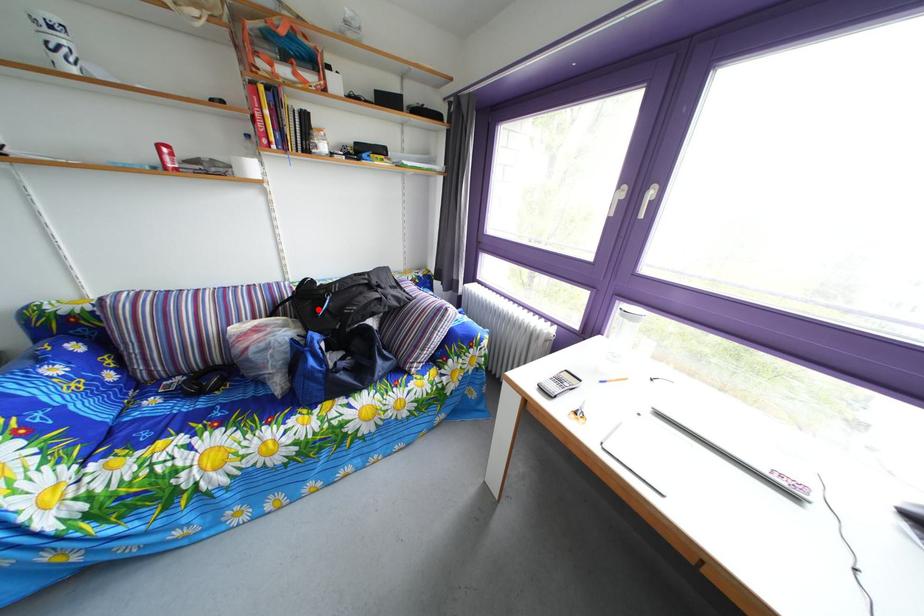
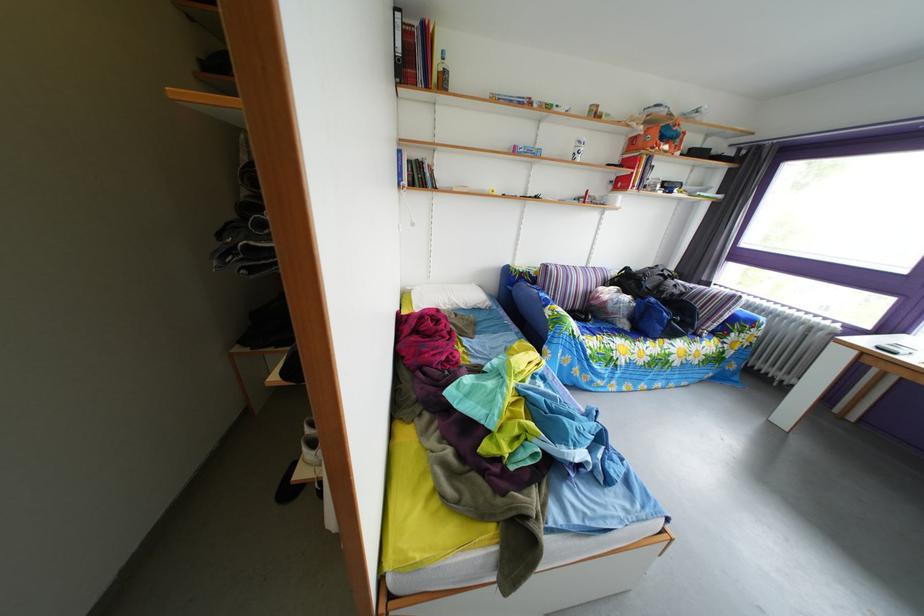
In the second image, find the point that corresponds to the highlighted location in the first image.

(638, 289)